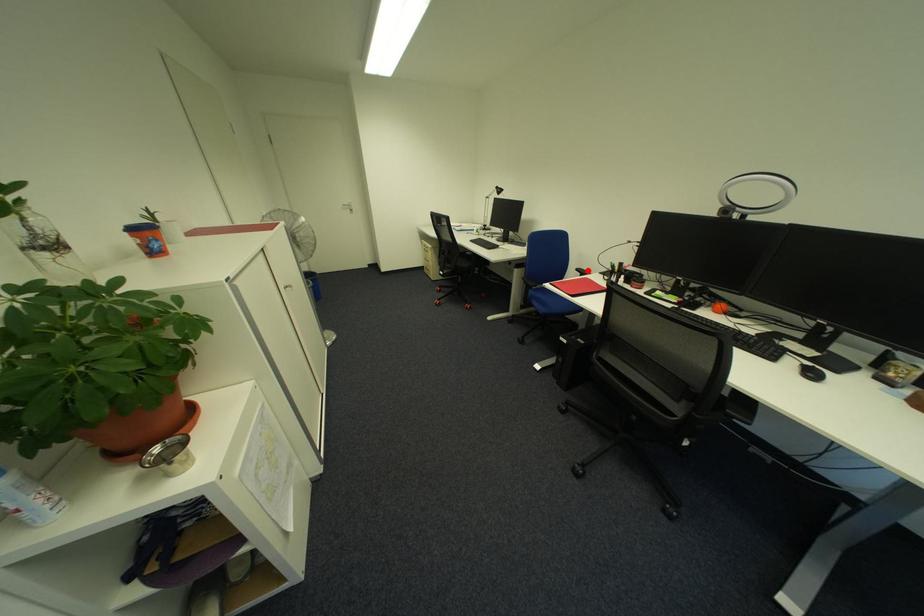
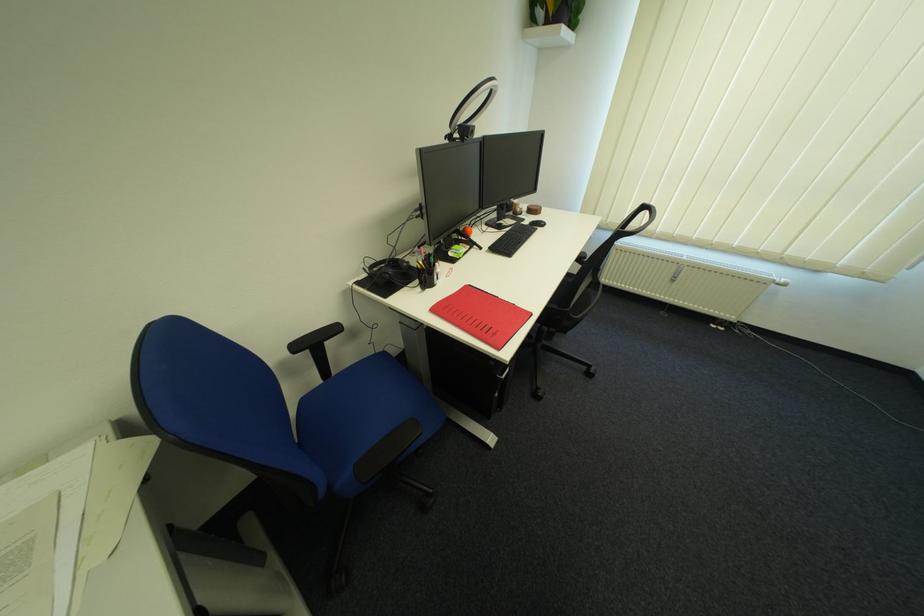
In the second image, find the point that corresponds to the highlighted location in the first image.

(306, 349)